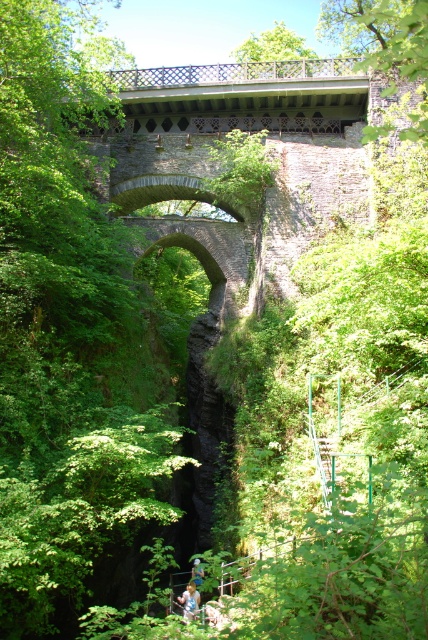
You are standing on the stone bridge and want to take a photo of the green leafy tree at center and the light blue fabric at lower center. Which object should you focus on first to ensure both are in sharp focus?

You should focus on the green leafy tree at center first because it is closer to the viewer than the light blue fabric at lower center, ensuring both are in focus when using depth of field appropriately.

You are planning to hang a 100 foot long rope between the green leafy tree at center and the light blue fabric at lower center. Will the rope reach between them?

The distance between the green leafy tree at center and the light blue fabric at lower center is 90.82 feet. Since the rope is 100 feet long, it will reach between them with some extra length remaining.